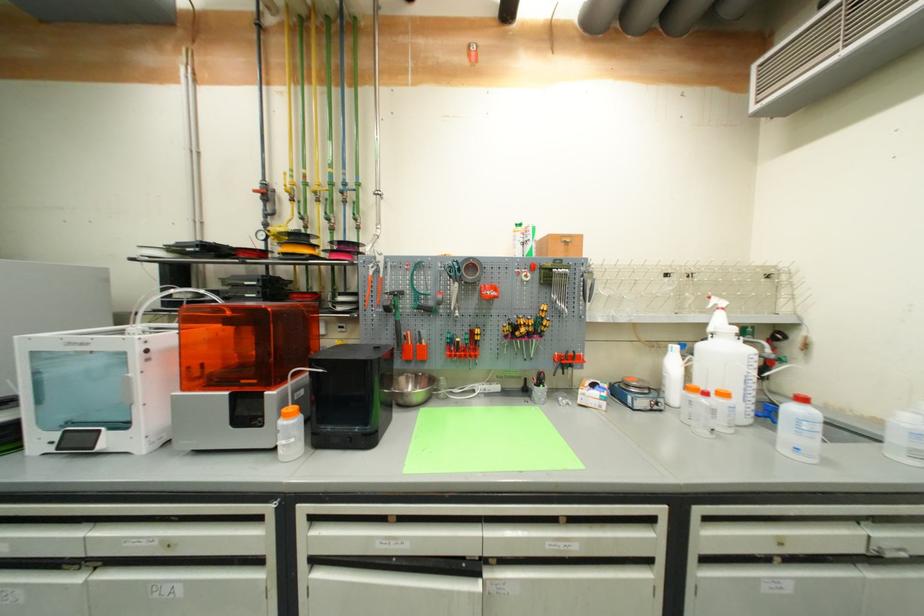
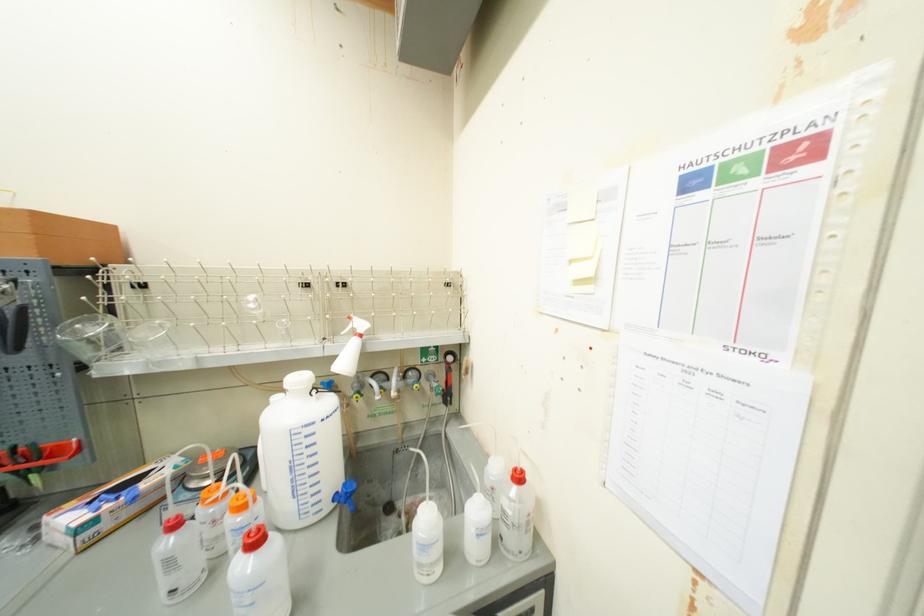
Question: The images are taken continuously from a first-person perspective. In which direction are you moving?

Choices:
 (A) Left
 (B) Right
 (C) Forward
 (D) Backward

Answer: (B)